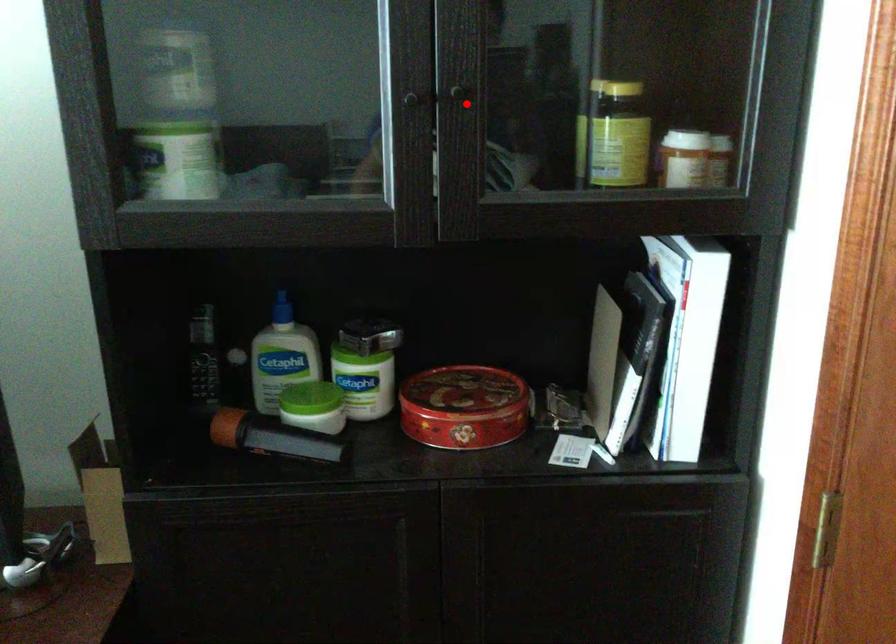
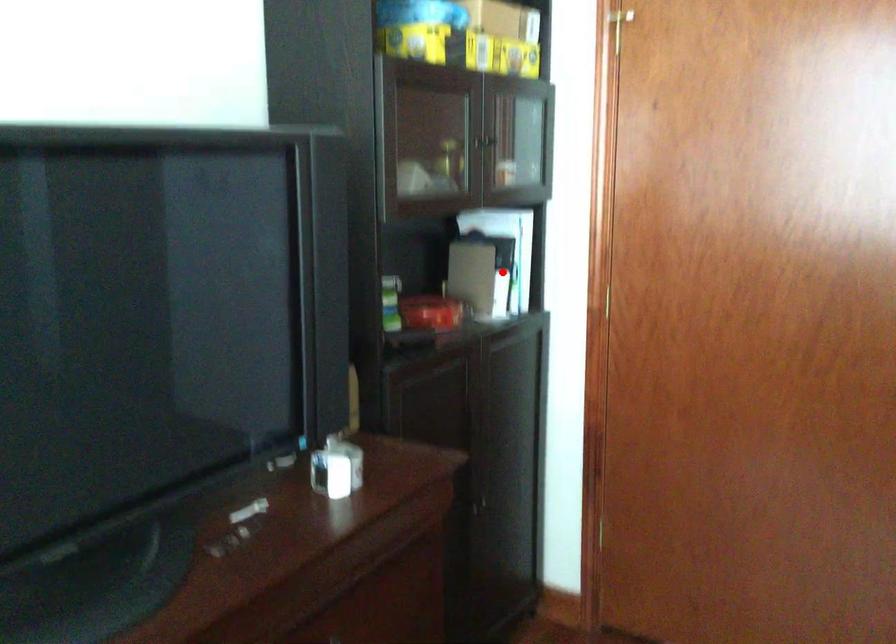
I am providing you with two images of the same scene from different viewpoints. A red point is marked on the first image and another point is marked on the second image. Does the point marked in image1 correspond to the same location as the one in image2?

No